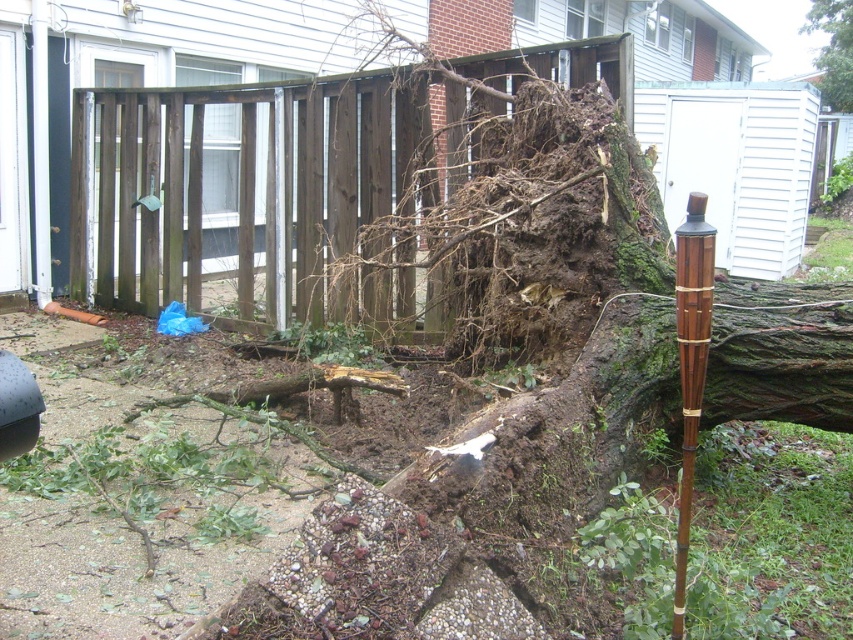
Based on the scene description, what is the 2D coordinate of the brown wooden fence at center?

The brown wooden fence at center is located at the 2D coordinate point of (267, 195).

You are a landscape architect examining the storm damage. You need to assess the distance between the brown bamboo pole at center and the green rough bark tree at upper right. Can you determine which one is closer to the viewer based on the scene?

The brown bamboo pole at center is closer to the viewer than the green rough bark tree at upper right.

You are standing at the center of the scene and want to place a new tiki torch. The existing brown wooden fence at center is represented by point (267,195). Where should you place the new tiki torch so it is 1 meter away from the fence?

Place the new tiki torch 1 meter away from the brown wooden fence at center, which is located at point (267,195). The exact coordinates would depend on the direction chosen, but maintaining a 1 meter distance ensures compliance with safety guidelines.